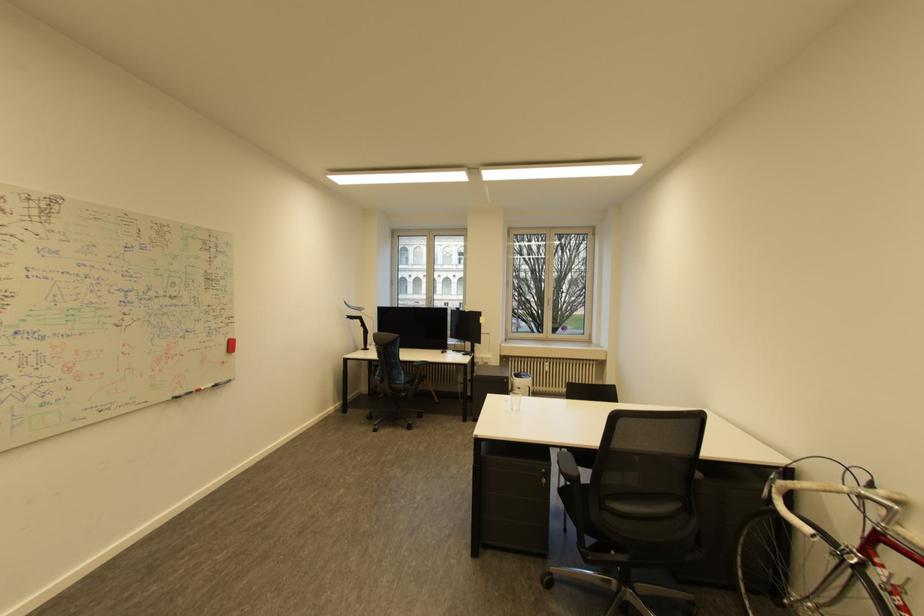
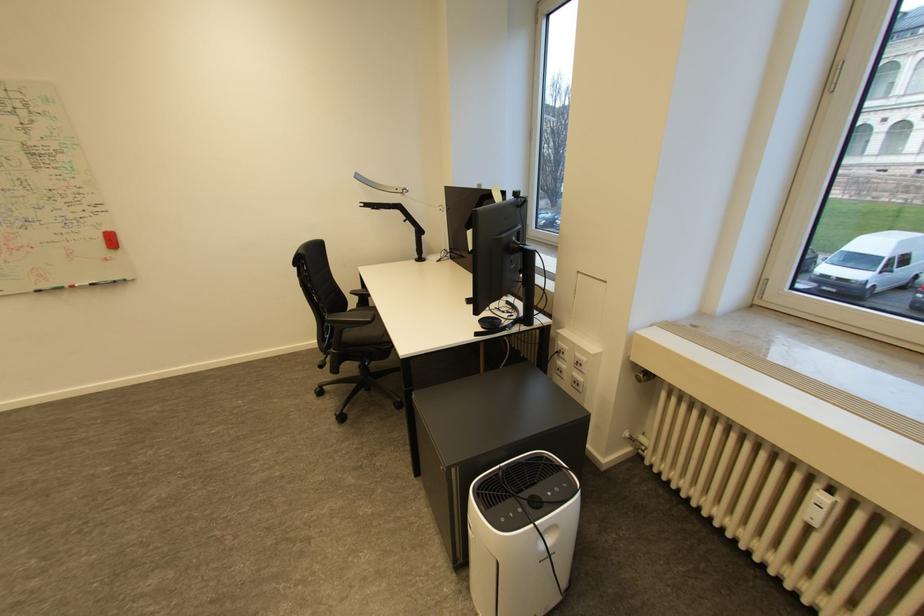
The point at (x=365, y=322) is marked in the first image. Where is the corresponding point in the second image?

(405, 213)